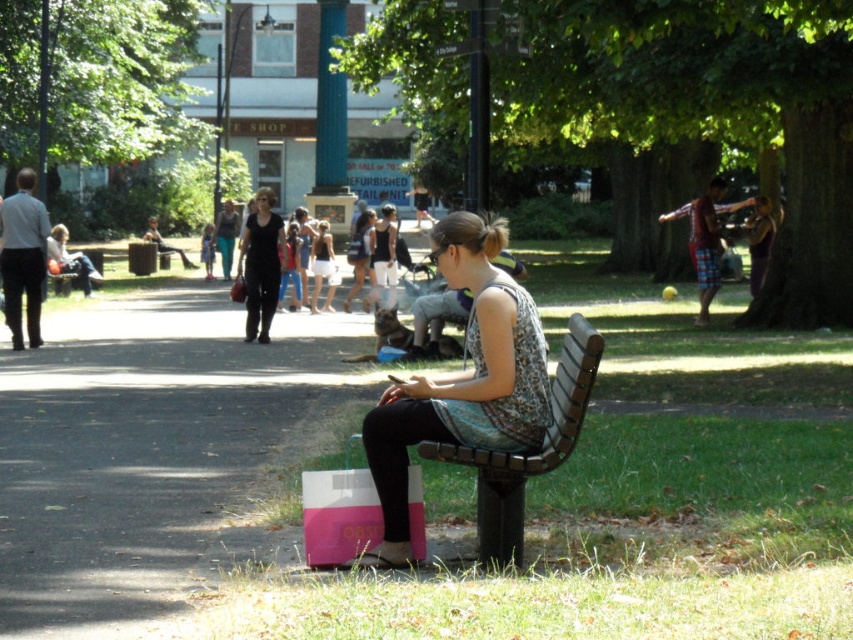
Question: Does wooden bench at center lie in front of white cotton dress at center?

Choices:
 (A) no
 (B) yes

Answer: (B)

Question: Can you confirm if patterned fabric dress at center is positioned above wooden bench at center?

Choices:
 (A) yes
 (B) no

Answer: (B)

Question: Which is nearer to the matte black jacket at center?

Choices:
 (A) wooden bench at center
 (B) pink matte shopping bag at lower center

Answer: (B)

Question: In this image, where is patterned fabric dress at center located relative to white cotton dress at center?

Choices:
 (A) below
 (B) above

Answer: (A)

Question: Which is nearer to the patterned fabric dress at center?

Choices:
 (A) white cotton dress at center
 (B) wooden bench at center

Answer: (B)

Question: Which point is closer to the camera?

Choices:
 (A) patterned fabric dress at center
 (B) wooden bench at center
 (C) pink matte shopping bag at lower center

Answer: (B)